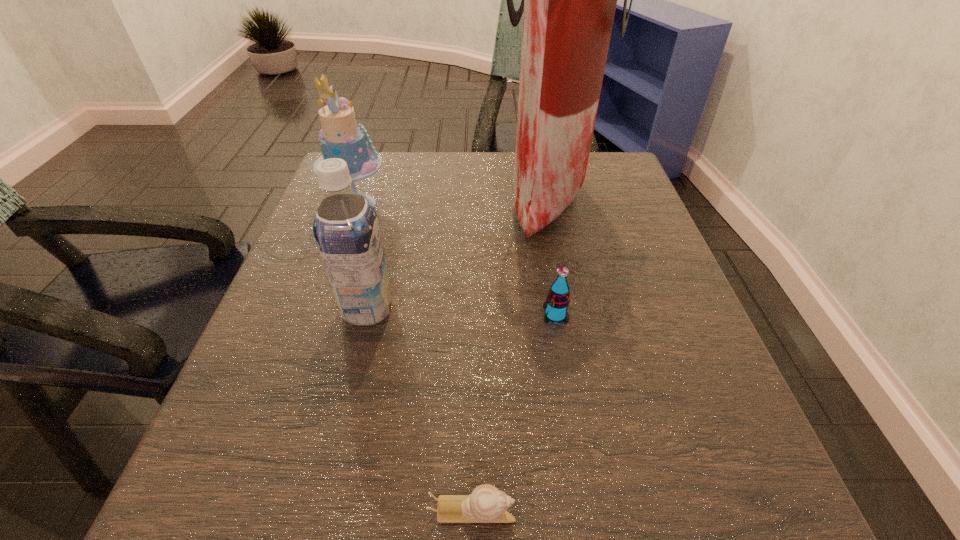
You are a GUI agent. You are given a task and a screenshot of the screen. Output one action in this format:
    pyautogui.click(x=<x>, y=<y>)
    Task: Click on the vacant region located 0.300m on the shell of the nearest object
    The width and height of the screenshot is (960, 540).
    Given the screenshot: What is the action you would take?
    pyautogui.click(x=760, y=511)

Identify the location of grocery bag situated at the far edge. This screenshot has width=960, height=540. (569, 0).

Locate an element on the screen. This screenshot has height=540, width=960. cake present at the far edge is located at coordinates (340, 137).

You are a GUI agent. You are given a task and a screenshot of the screen. Output one action in this format:
    pyautogui.click(x=<x>, y=<y>)
    Task: Click on the object located at the near edge
    The image size is (960, 540).
    Given the screenshot: What is the action you would take?
    pyautogui.click(x=486, y=504)

Find the location of a particular element. This screenshot has width=960, height=540. cake located in the left edge section of the desktop is located at coordinates (340, 137).

Image resolution: width=960 pixels, height=540 pixels. Find the location of `soya milk at the left edge`. soya milk at the left edge is located at coordinates (346, 229).

At what (x,y) coordinates should I click in order to perform the action: click on object at the right edge. Please return your answer as a coordinate pair (x, y). The height and width of the screenshot is (540, 960). Looking at the image, I should click on (569, 0).

Where is `object situated at the far left corner`? object situated at the far left corner is located at coordinates (340, 137).

At what (x,y) coordinates should I click in order to perform the action: click on object that is positioned at the far right corner. Please return your answer as a coordinate pair (x, y). This screenshot has width=960, height=540. Looking at the image, I should click on (569, 0).

This screenshot has width=960, height=540. In the image, there is a desktop. What are the coordinates of `vacant space at the far edge` in the screenshot? It's located at (514, 157).